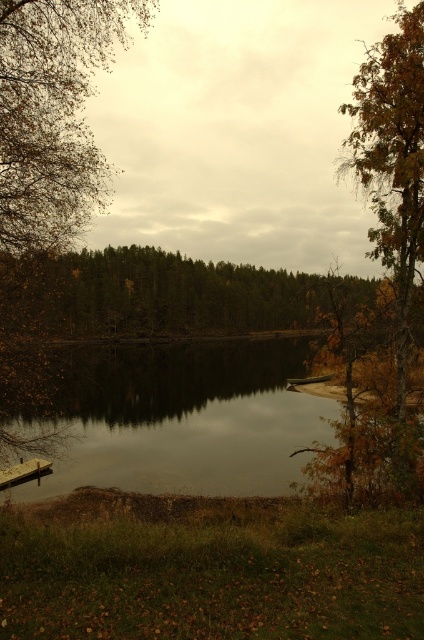
This screenshot has height=640, width=424. What are the coordinates of `brown leafy tree at right` in the screenshot? It's located at (382, 264).

Which of these two, brown leafy tree at right or brown leafy tree at left, stands taller?

With more height is brown leafy tree at right.

Locate an element on the screen. brown leafy tree at right is located at coordinates (382, 264).